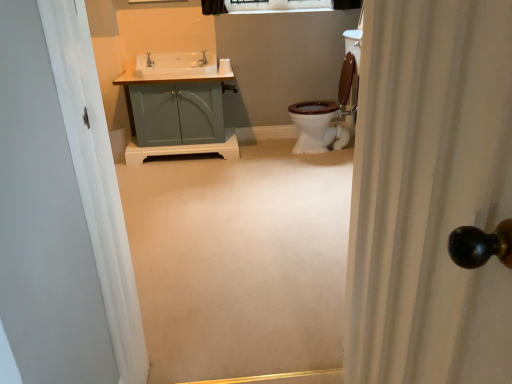
Question: Considering the relative sizes of white textured shower curtain at right and matte teal cabinet at center in the image provided, is white textured shower curtain at right shorter than matte teal cabinet at center?

Choices:
 (A) no
 (B) yes

Answer: (A)

Question: Can you confirm if white textured shower curtain at right is wider than matte teal cabinet at center?

Choices:
 (A) no
 (B) yes

Answer: (A)

Question: Is white textured shower curtain at right looking in the opposite direction of matte teal cabinet at center?

Choices:
 (A) no
 (B) yes

Answer: (A)

Question: Is white textured shower curtain at right positioned beyond the bounds of matte teal cabinet at center?

Choices:
 (A) yes
 (B) no

Answer: (A)

Question: Is matte teal cabinet at center a part of white textured shower curtain at right?

Choices:
 (A) no
 (B) yes

Answer: (A)

Question: Is white textured shower curtain at right taller than matte teal cabinet at center?

Choices:
 (A) yes
 (B) no

Answer: (A)

Question: Does white textured shower curtain at right come behind clear glass window at upper center?

Choices:
 (A) no
 (B) yes

Answer: (A)

Question: Is white textured shower curtain at right outside of clear glass window at upper center?

Choices:
 (A) yes
 (B) no

Answer: (A)

Question: Is white textured shower curtain at right in contact with clear glass window at upper center?

Choices:
 (A) no
 (B) yes

Answer: (A)

Question: Is white textured shower curtain at right wider than clear glass window at upper center?

Choices:
 (A) yes
 (B) no

Answer: (A)

Question: Is white textured shower curtain at right turned away from clear glass window at upper center?

Choices:
 (A) yes
 (B) no

Answer: (B)

Question: Can you confirm if white textured shower curtain at right is bigger than clear glass window at upper center?

Choices:
 (A) no
 (B) yes

Answer: (B)

Question: Is the position of matte silver faucet at upper center less distant than that of clear glass window at upper center?

Choices:
 (A) no
 (B) yes

Answer: (B)